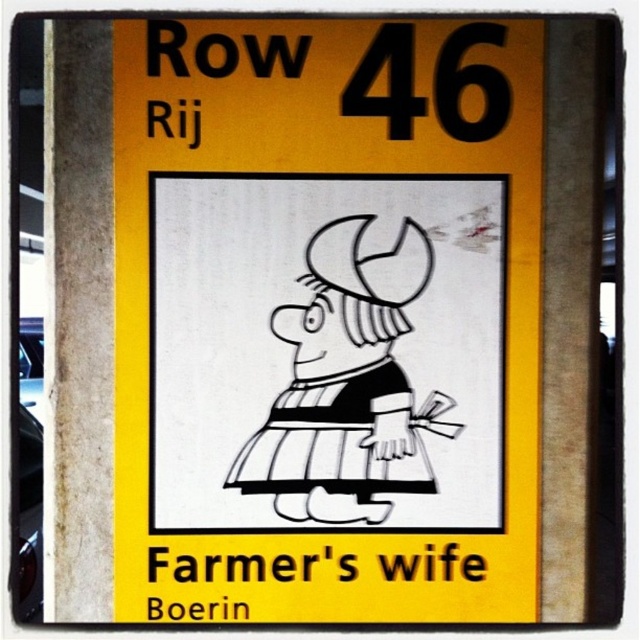
You are standing in front of the sign described. There are two points marked on the sign. The first point is at coordinate point (x=173, y=362) and the second is at point (x=452, y=403). Which point is closer to you?

Point (x=173, y=362) is closer to the viewer than point (x=452, y=403).